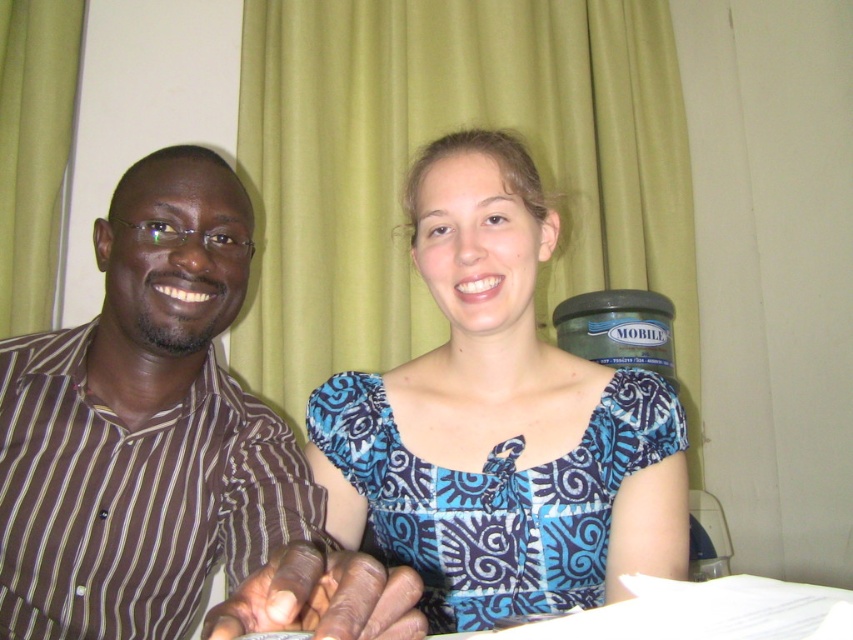
Question: Does brown striped shirt at left appear under blue printed dress at center?

Choices:
 (A) no
 (B) yes

Answer: (B)

Question: Which object is closer to the camera taking this photo?

Choices:
 (A) brown striped shirt at left
 (B) blue printed dress at center

Answer: (A)

Question: Which point is farther from the camera taking this photo?

Choices:
 (A) (6, 636)
 (B) (505, 168)

Answer: (B)

Question: Does brown striped shirt at left appear over blue printed dress at center?

Choices:
 (A) no
 (B) yes

Answer: (A)

Question: Does brown striped shirt at left have a larger size compared to blue printed dress at center?

Choices:
 (A) no
 (B) yes

Answer: (B)